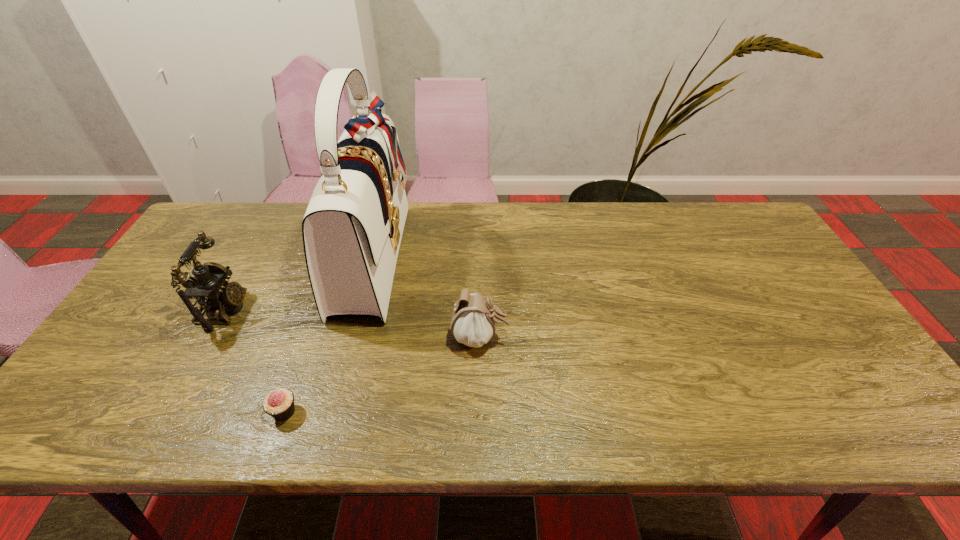
What are the coordinates of `free region located 0.350m on the right of the nearest object` in the screenshot? It's located at (458, 412).

The width and height of the screenshot is (960, 540). I want to click on object located in the far edge section of the desktop, so click(352, 229).

At what (x,y) coordinates should I click in order to perform the action: click on object positioned at the near edge. Please return your answer as a coordinate pair (x, y). Looking at the image, I should click on (279, 404).

Locate an element on the screen. Image resolution: width=960 pixels, height=540 pixels. vacant space at the far edge is located at coordinates (546, 210).

Image resolution: width=960 pixels, height=540 pixels. In the image, there is a desktop. Identify the location of free region at the left edge. (160, 370).

You are a GUI agent. You are given a task and a screenshot of the screen. Output one action in this format:
    pyautogui.click(x=<x>, y=<y>)
    Task: Click on the vacant space at the right edge
    
    Given the screenshot: What is the action you would take?
    pyautogui.click(x=772, y=318)

In the image, there is a desktop. In order to click on vacant area at the far left corner in this screenshot , I will do `click(257, 213)`.

I want to click on vacant point located between the tallest object and the pouch, so click(x=426, y=296).

This screenshot has height=540, width=960. I want to click on vacant space that is in between the nearest object and the rightmost object, so tap(382, 375).

Where is `vacant region between the cupcake and the leftmost object`? This screenshot has width=960, height=540. vacant region between the cupcake and the leftmost object is located at coordinates (254, 361).